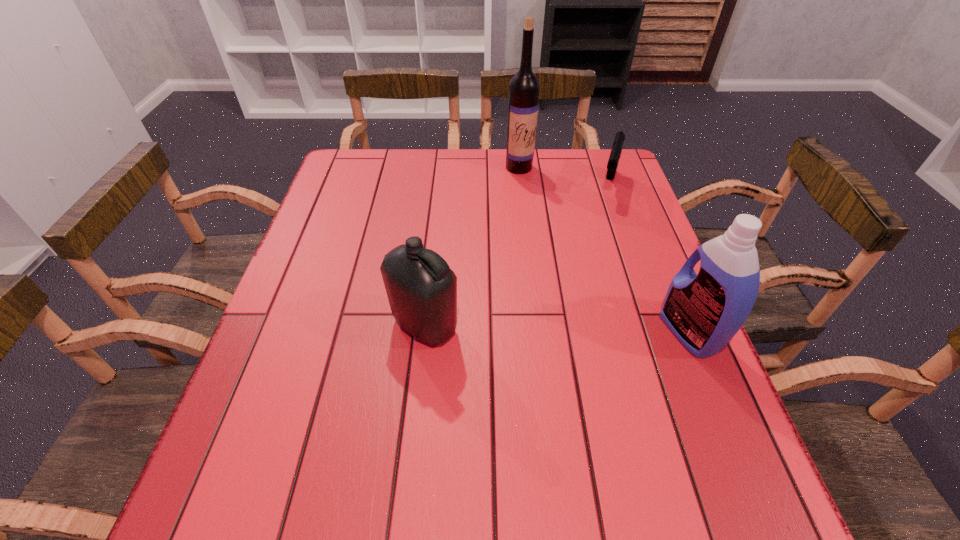
You are a GUI agent. You are given a task and a screenshot of the screen. Output one action in this format:
    pyautogui.click(x=<x>, y=<y>)
    Task: Click on the vacant region that satisfies the following two spatial constraints: 1. on the front side of the detergent; 2. on the right side of the third tallest object
    The height and width of the screenshot is (540, 960).
    Given the screenshot: What is the action you would take?
    pyautogui.click(x=424, y=332)